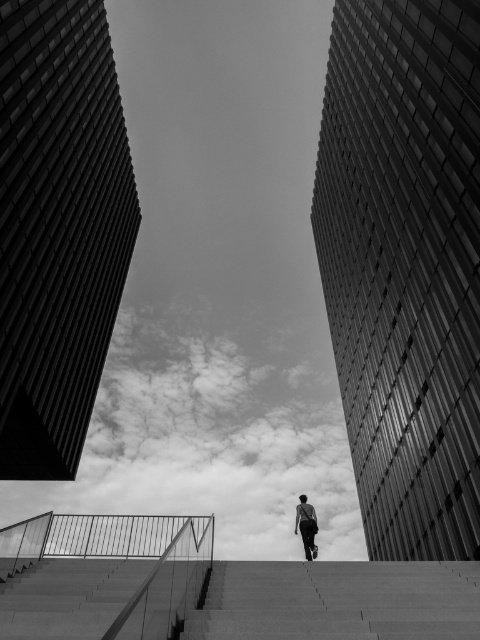
Which is below, smooth concrete stairs at center or dark gray fabric man at center?

dark gray fabric man at center is lower down.

Does smooth concrete stairs at center have a lesser height compared to dark gray fabric man at center?

Yes.

Between point (332, 598) and point (312, 529), which one is positioned in front?

Point (332, 598)

The image size is (480, 640). Identify the location of smooth concrete stairs at center. (338, 600).